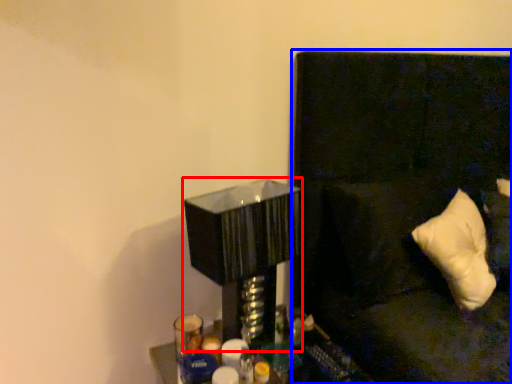
Question: Which object appears farthest to the camera in this image, table lamp (highlighted by a red box) or couch (highlighted by a blue box)?

Choices:
 (A) table lamp
 (B) couch

Answer: (B)